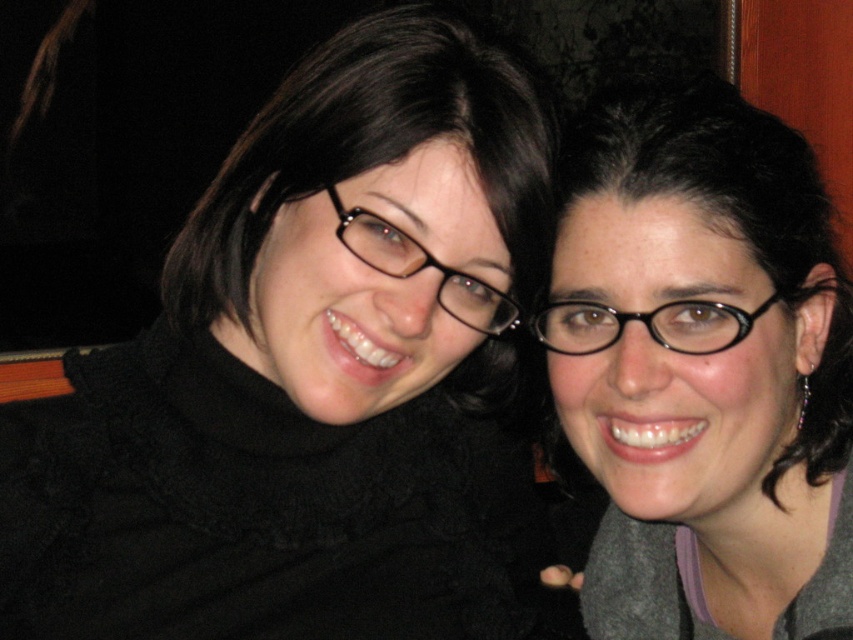
Question: Does black matte glasses at center appear under black plastic glasses at right?

Choices:
 (A) no
 (B) yes

Answer: (B)

Question: Based on their relative distances, which object is farther from the matte black sweater at upper left?

Choices:
 (A) black matte glasses at center
 (B) black plastic glasses at center

Answer: (A)

Question: Does matte black sweater at upper left appear on the left side of black plastic glasses at center?

Choices:
 (A) no
 (B) yes

Answer: (B)

Question: Can you confirm if black plastic glasses at right is positioned to the left of black plastic glasses at center?

Choices:
 (A) no
 (B) yes

Answer: (A)

Question: Which is nearer to the black plastic glasses at right?

Choices:
 (A) matte black sweater at upper left
 (B) black matte glasses at center
 (C) black plastic glasses at center

Answer: (C)

Question: Which of the following is the closest to the observer?

Choices:
 (A) black matte glasses at center
 (B) black plastic glasses at center
 (C) black plastic glasses at right
 (D) matte black sweater at upper left

Answer: (B)